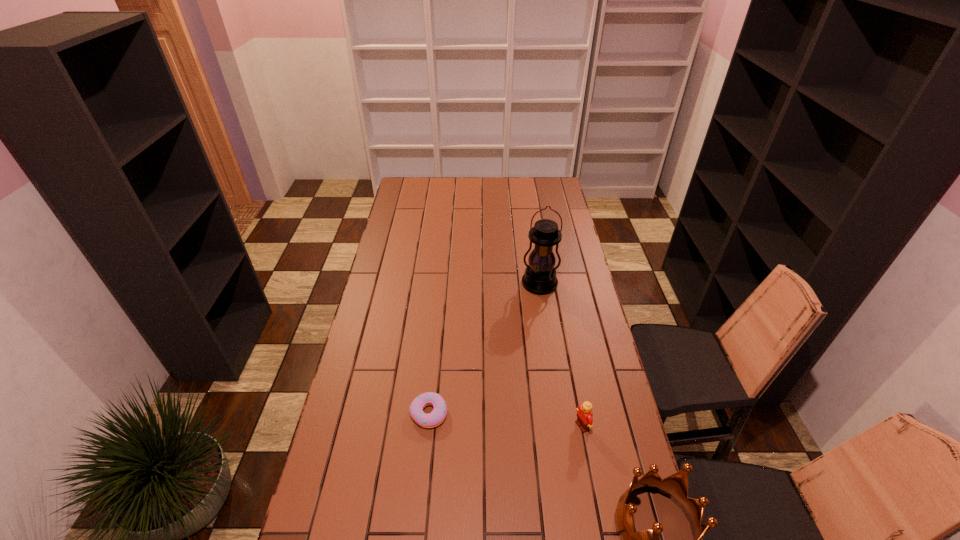
I want to click on vacant space that satisfies the following two spatial constraints: 1. on the front side of the second shortest object; 2. on the right side of the shortest object, so click(x=427, y=426).